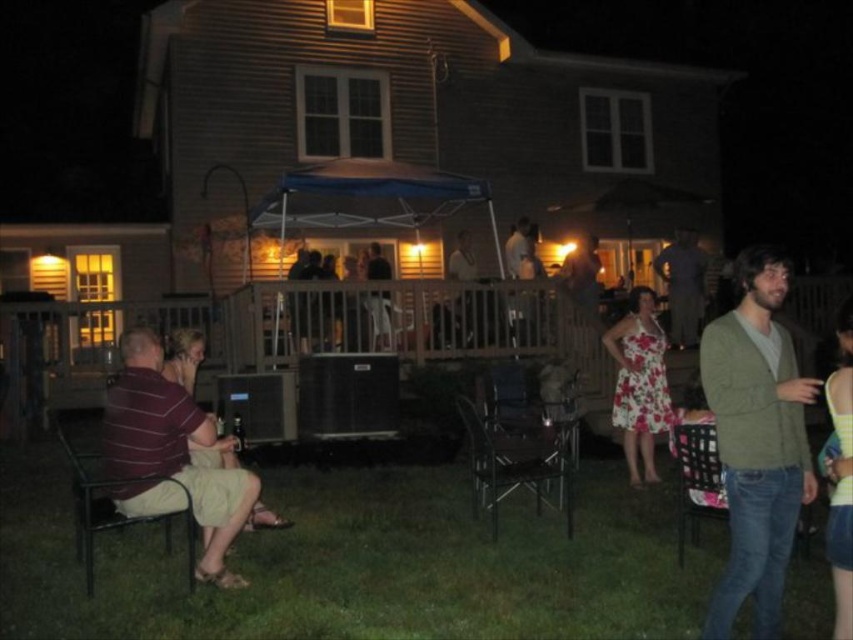
You are standing in the backyard and want to place a small decoration between the two points marked as point (x=728, y=400) and point (x=709, y=506). Which point should the decoration be closer to in order to appear larger in the photo?

The decoration should be placed closer to point (x=728, y=400) because it is closer to the camera, making objects placed there appear larger in the photo.

You are organizing a small gathering and need to place a large decorative pillow. The green sweater at right and the metallic silver chair at lower right are in the way. Which object should you move to make space for the pillow?

The green sweater at right has a larger size compared to the metallic silver chair at lower right, so you should move the green sweater at right to make space for the large decorative pillow.